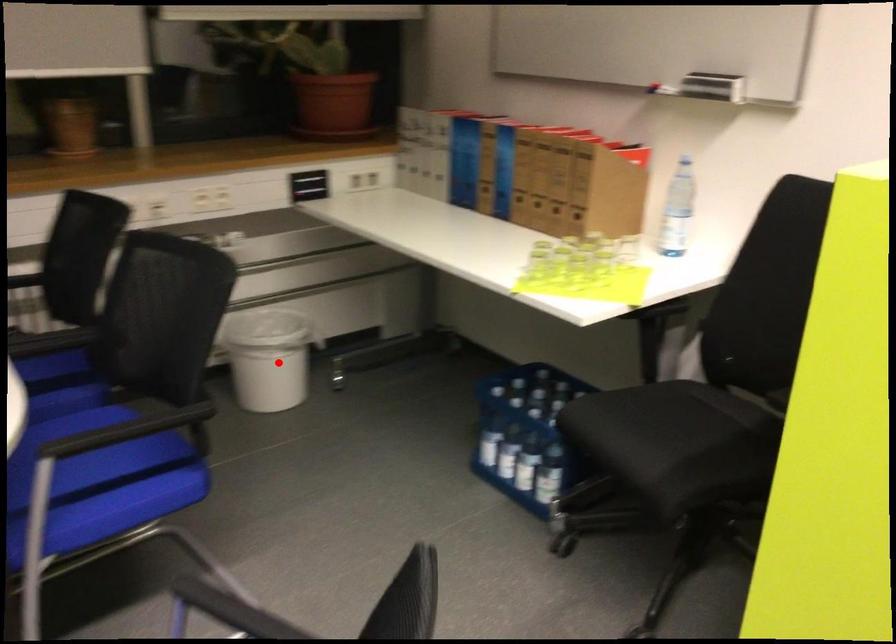
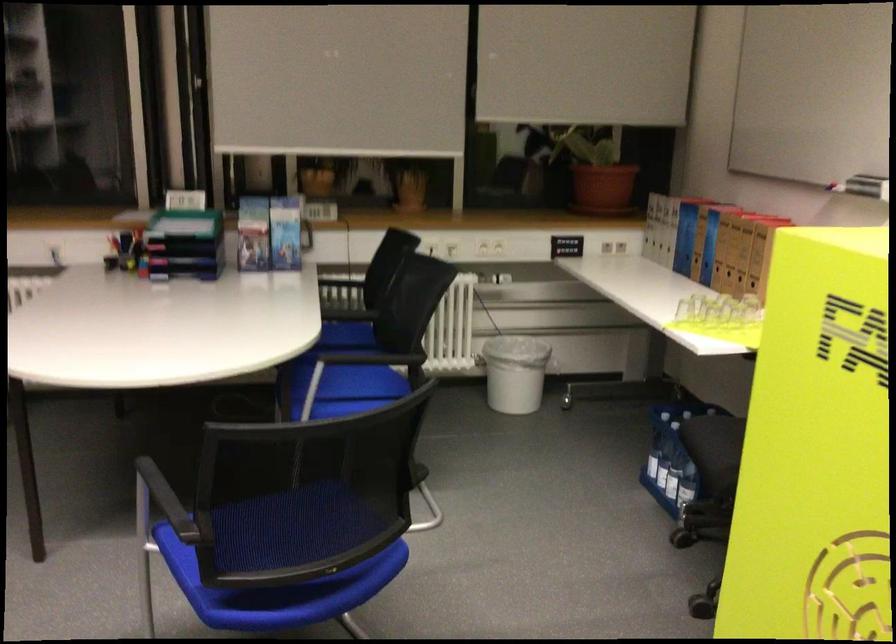
Question: A red point is marked in image1. In image2, is the corresponding 3D point closer to the camera or farther? Reply with the corresponding letter.

Choices:
 (A) The corresponding 3D point is closer.
 (B) The corresponding 3D point is farther.

Answer: (B)